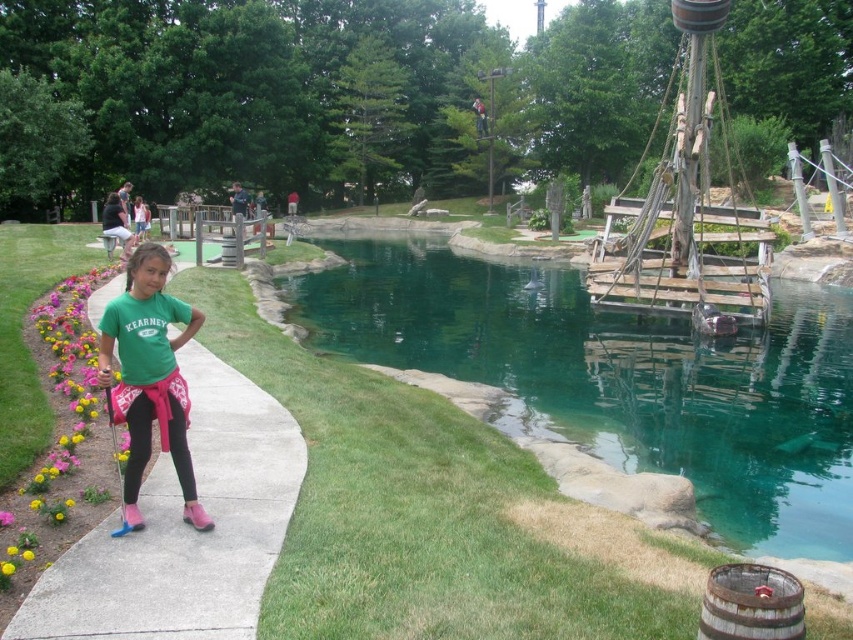
You are a gardener who needs to place a 20cm wide flower pot on the concrete sidewalk at center left. Can the flower pot fit on the sidewalk without overlapping the green matte shirt at center?

The concrete sidewalk at center left is wider than the green matte shirt at center, so the 20cm wide flower pot can fit on the sidewalk without overlapping the green matte shirt at center.

You are a golfer standing on the pathway and want to hit a ball to the water. Which object is closer to your current position, the teal glassy water at center or the green matte shirt at center?

The green matte shirt at center is closer to your current position because it is on the left side of the teal glassy water at center, which is positioned to its right.

You are a photographer trying to capture the young girl in the green matte shirt at center without the teal glassy water at center reflecting in the shot. Is it possible to adjust your position to achieve this?

The green matte shirt at center is behind the teal glassy water at center, so you cannot avoid capturing the teal glassy water at center in the shot if you want to include the green matte shirt at center in the frame.